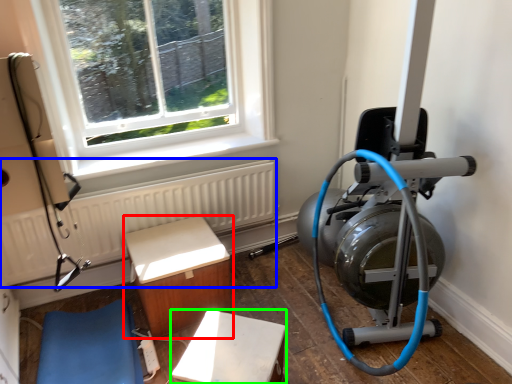
Question: Which is farther away from furniture (highlighted by a red box)? radiator (highlighted by a blue box) or furniture (highlighted by a green box)?

Choices:
 (A) radiator
 (B) furniture

Answer: (B)